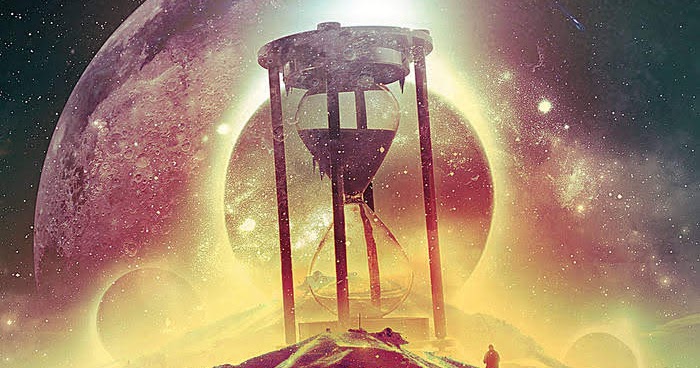
I want to click on hourglass, so click(358, 160).